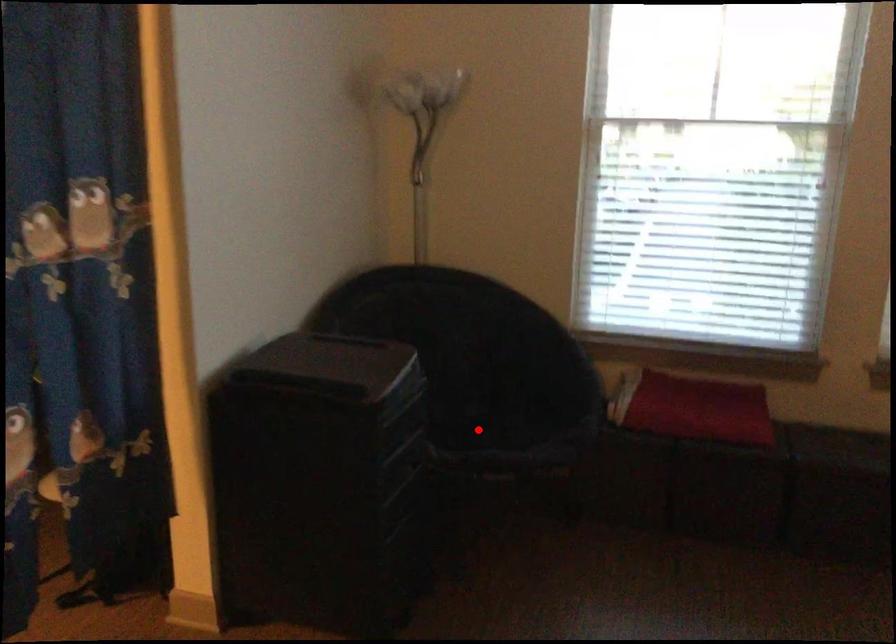
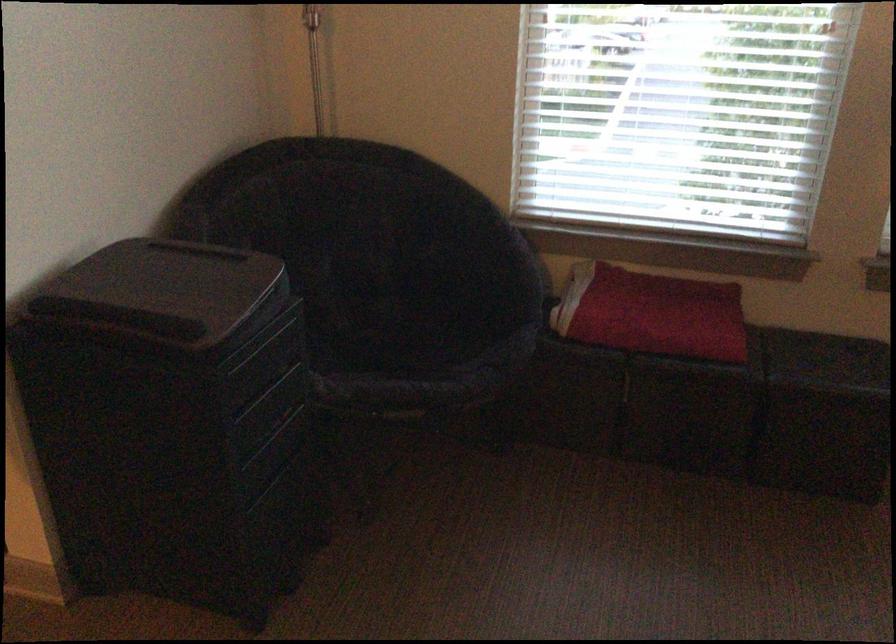
Question: A red point is marked in image1. In image2, is the corresponding 3D point closer to the camera or farther? Reply with the corresponding letter.

Choices:
 (A) The corresponding 3D point is closer.
 (B) The corresponding 3D point is farther.

Answer: (A)